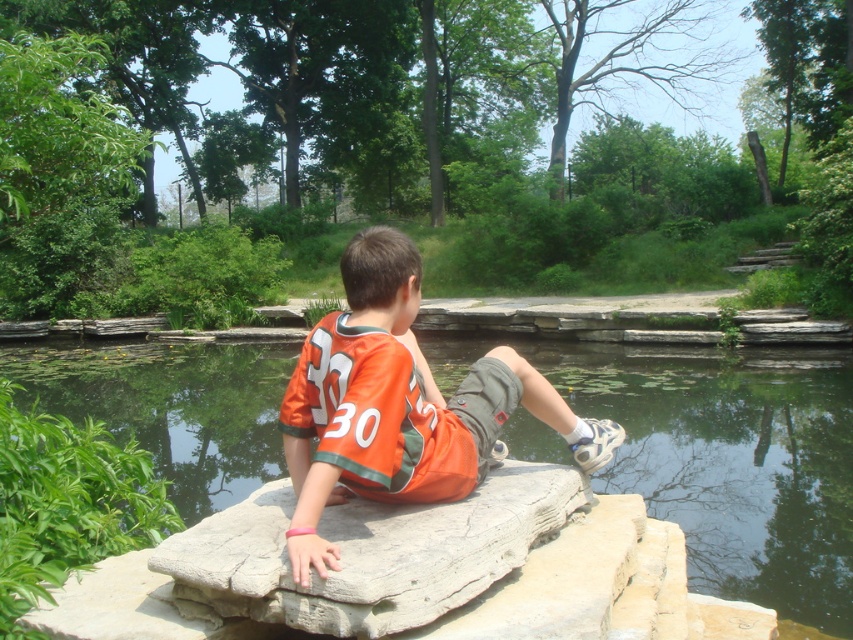
You are a photographer trying to capture a shot of the orange jersey at center and the greenish water at center. Which object is positioned lower in the image?

The greenish water at center is positioned below the orange jersey at center, so it is lower in the image.

You are navigating through the scene and want to reach the point at coordinates point (645,488). You are currently at point (396,326). Which direction should you move to get closer to your destination?

To reach point (645,488) from point (396,326), you should move towards the direction of the destination point, which is behind the current position. Since point (645,488) is behind point (396,326), you need to move backward or in the direction away from your current facing to reach it.